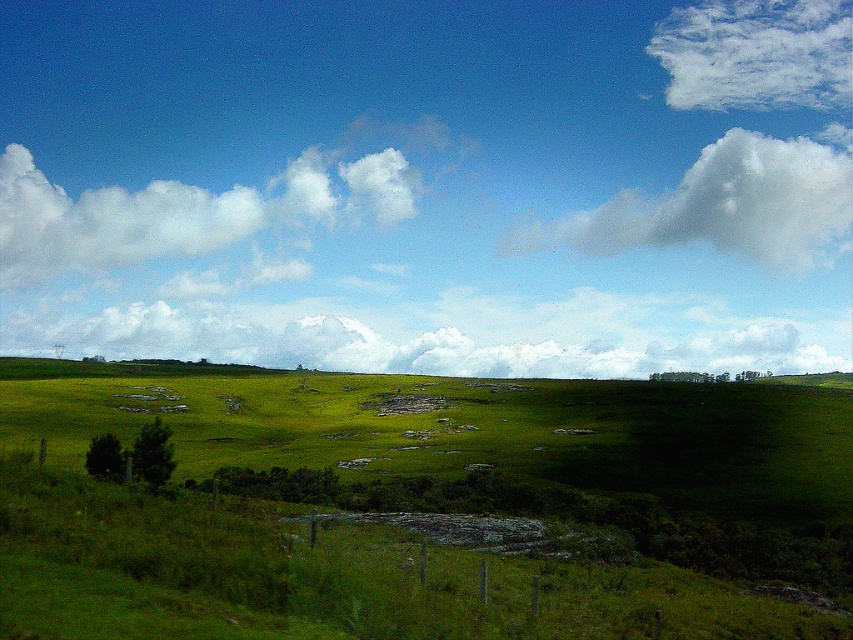
Which of these two, white fluffy cloud at upper center or white fluffy cloud at upper right, stands shorter?

white fluffy cloud at upper right is shorter.

Looking at this image, does white fluffy cloud at upper center come behind white fluffy cloud at upper right?

No.

Which is in front, point (523, 246) or point (728, 68)?

Point (523, 246) is in front.

At what (x,y) coordinates should I click in order to perform the action: click on white fluffy cloud at upper center. Please return your answer as a coordinate pair (x, y). Looking at the image, I should click on (722, 205).

Is white fluffy cloud at center thinner than white fluffy cloud at upper right?

In fact, white fluffy cloud at center might be wider than white fluffy cloud at upper right.

The width and height of the screenshot is (853, 640). What do you see at coordinates (439, 339) in the screenshot? I see `white fluffy cloud at center` at bounding box center [439, 339].

This screenshot has height=640, width=853. I want to click on white fluffy cloud at center, so click(439, 339).

Find the location of a particular element. The width and height of the screenshot is (853, 640). white fluffy cloud at upper center is located at coordinates (722, 205).

Between white fluffy cloud at upper center and white fluffy cloud at upper left, which one is positioned higher?

white fluffy cloud at upper center is above.

Which is in front, point (764, 179) or point (146, 257)?

Positioned in front is point (146, 257).

The image size is (853, 640). In order to click on white fluffy cloud at upper center in this screenshot , I will do `click(722, 205)`.